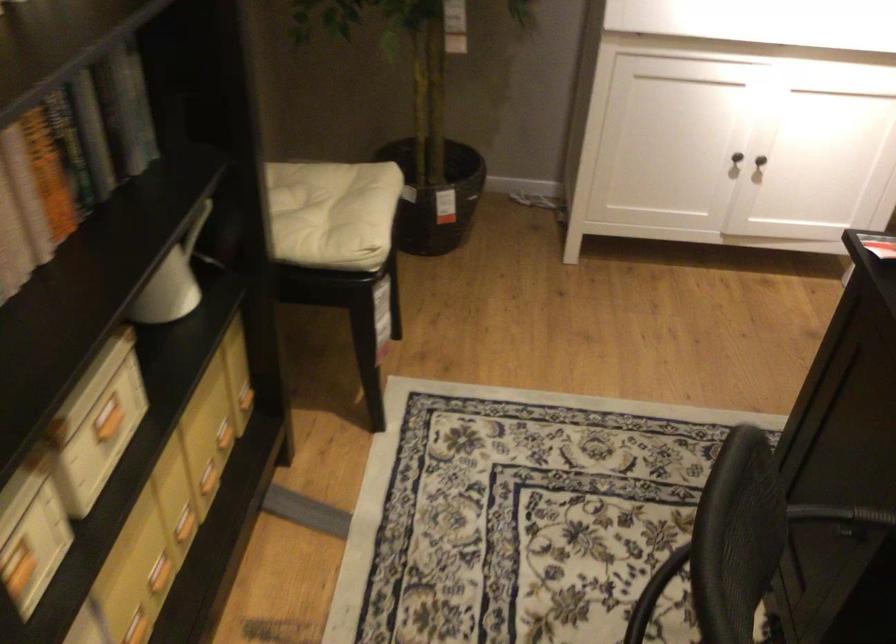
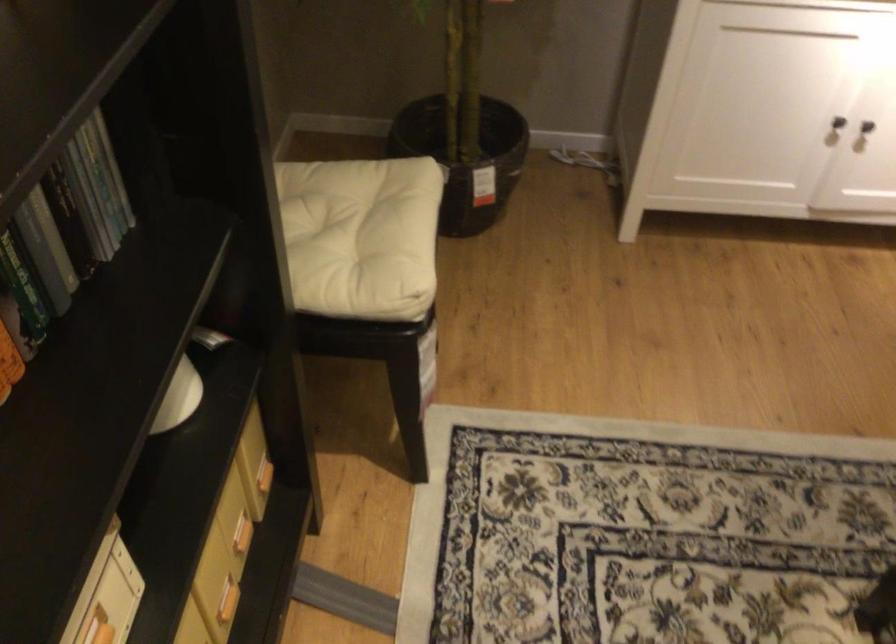
Where in the second image is the point corresponding to [204,482] from the first image?

(227, 601)